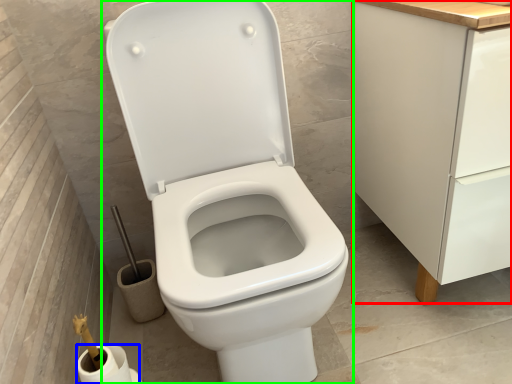
Question: Based on their relative distances, which object is nearer to cabinetry (highlighted by a red box)? Choose from toilet paper (highlighted by a blue box) and toilet (highlighted by a green box).

Choices:
 (A) toilet paper
 (B) toilet

Answer: (B)